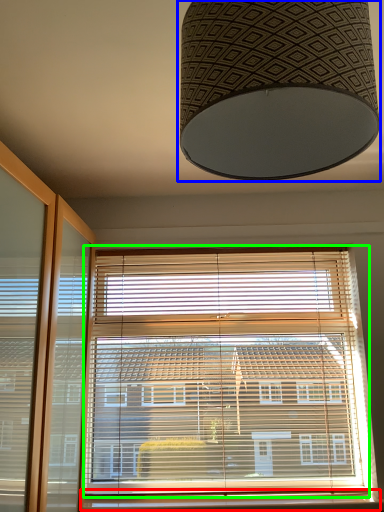
Question: Which is nearer to the window sill (highlighted by a red box)? lamp (highlighted by a blue box) or window blind (highlighted by a green box).

Choices:
 (A) lamp
 (B) window blind

Answer: (B)